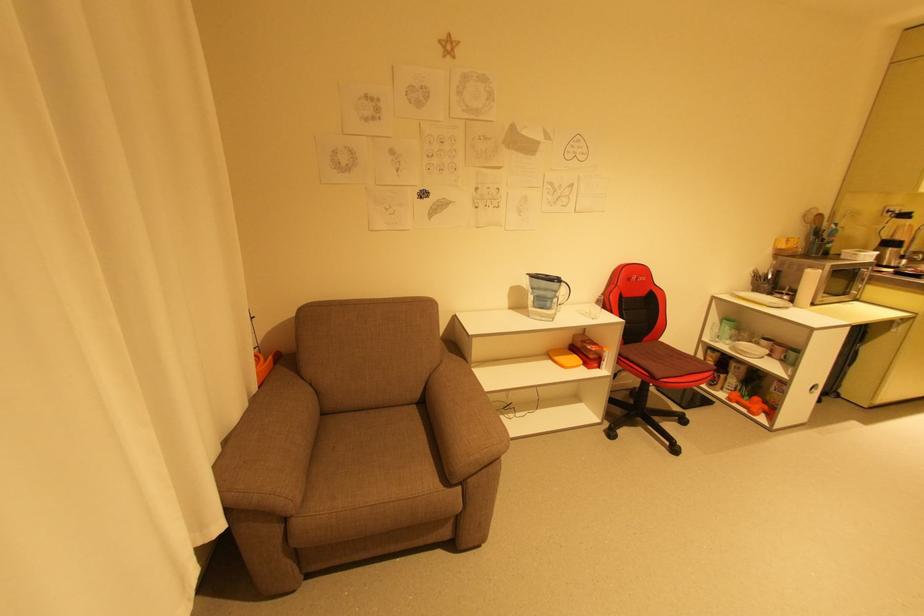
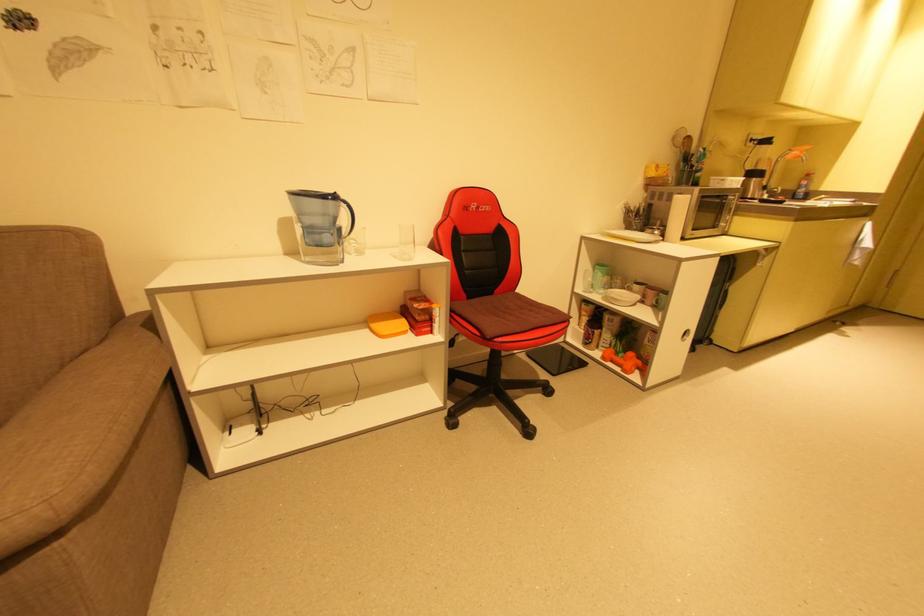
Question: The first image is from the beginning of the video and the second image is from the end. How did the camera likely rotate when shooting the video?

Choices:
 (A) Left
 (B) Right
 (C) Up
 (D) Down

Answer: (B)